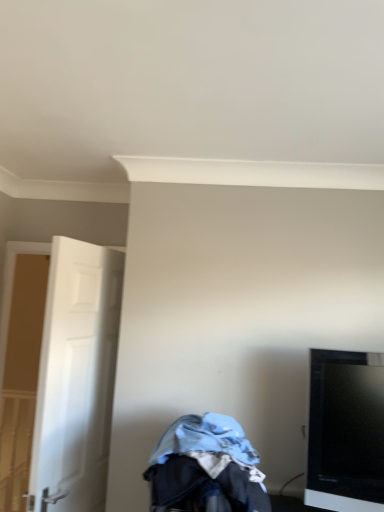
Identify the location of black glossy tv at right. (345, 431).

From the image's perspective, does denim fabric baby carriage at lower center appear lower than black glossy tv at right?

Yes, from the image's perspective, denim fabric baby carriage at lower center is beneath black glossy tv at right.

Is denim fabric baby carriage at lower center bigger than black glossy tv at right?

Yes, denim fabric baby carriage at lower center is bigger than black glossy tv at right.

Choose the correct answer: Is denim fabric baby carriage at lower center inside black glossy tv at right or outside it?

denim fabric baby carriage at lower center is outside black glossy tv at right.

Is white matte door at left bigger than black glossy tv at right?

Indeed, white matte door at left has a larger size compared to black glossy tv at right.

Between white matte door at left and black glossy tv at right, which one has larger width?

Wider between the two is black glossy tv at right.

Identify the location of door above the black glossy tv at right (from a real-world perspective). (76, 377).

Considering the sizes of white matte door at left and denim fabric baby carriage at lower center in the image, is white matte door at left bigger or smaller than denim fabric baby carriage at lower center?

white matte door at left is bigger than denim fabric baby carriage at lower center.

Is white matte door at left not near denim fabric baby carriage at lower center?

No, white matte door at left is not far away from denim fabric baby carriage at lower center.

Which object is more forward, white matte door at left or denim fabric baby carriage at lower center?

Positioned in front is denim fabric baby carriage at lower center.

Considering the positions of objects black glossy tv at right and denim fabric baby carriage at lower center in the image provided, who is more to the right, black glossy tv at right or denim fabric baby carriage at lower center?

Positioned to the right is black glossy tv at right.

Looking at their sizes, would you say black glossy tv at right is wider or thinner than denim fabric baby carriage at lower center?

Clearly, black glossy tv at right has less width compared to denim fabric baby carriage at lower center.

Is black glossy tv at right facing away from denim fabric baby carriage at lower center?

black glossy tv at right is not turned away from denim fabric baby carriage at lower center.

From the image's perspective, which is above, black glossy tv at right or denim fabric baby carriage at lower center?

From the image's view, black glossy tv at right is above.

Which of these two, denim fabric baby carriage at lower center or white matte door at left, is wider?

Wider between the two is denim fabric baby carriage at lower center.

Is denim fabric baby carriage at lower center far away from white matte door at left?

No, there isn't a large distance between denim fabric baby carriage at lower center and white matte door at left.

Considering the sizes of denim fabric baby carriage at lower center and white matte door at left in the image, is denim fabric baby carriage at lower center bigger or smaller than white matte door at left?

Clearly, denim fabric baby carriage at lower center is smaller in size than white matte door at left.

Looking at this image, measure the distance between denim fabric baby carriage at lower center and white matte door at left.

69.31 centimeters.

Between point (332, 408) and point (67, 366), which one is positioned behind?

The point (67, 366) is farther.

Is black glossy tv at right taller or shorter than white matte door at left?

Considering their sizes, black glossy tv at right has less height than white matte door at left.

Considering the sizes of objects black glossy tv at right and white matte door at left in the image provided, who is thinner, black glossy tv at right or white matte door at left?

white matte door at left.

How much distance is there between black glossy tv at right and white matte door at left?

A distance of 3.39 feet exists between black glossy tv at right and white matte door at left.

This screenshot has width=384, height=512. I want to click on baby carriage below the black glossy tv at right (from a real-world perspective), so click(x=205, y=466).

Locate an element on the screen. television on the right of white matte door at left is located at coordinates (345, 431).

Looking at this image, from the image, which object appears to be farther from black glossy tv at right, white matte door at left or denim fabric baby carriage at lower center?

white matte door at left lies further to black glossy tv at right than the other object.

From the image, which object appears to be nearer to white matte door at left, denim fabric baby carriage at lower center or black glossy tv at right?

denim fabric baby carriage at lower center is closer to white matte door at left.

From the image, which object appears to be nearer to denim fabric baby carriage at lower center, black glossy tv at right or white matte door at left?

black glossy tv at right is positioned closer to the anchor denim fabric baby carriage at lower center.

When comparing their distances from white matte door at left, does black glossy tv at right or denim fabric baby carriage at lower center seem closer?

denim fabric baby carriage at lower center lies closer to white matte door at left than the other object.

Considering their positions, is white matte door at left positioned further to denim fabric baby carriage at lower center than black glossy tv at right?

white matte door at left is positioned further to the anchor denim fabric baby carriage at lower center.

Based on their spatial positions, is denim fabric baby carriage at lower center or white matte door at left closer to black glossy tv at right?

denim fabric baby carriage at lower center is closer to black glossy tv at right.

Image resolution: width=384 pixels, height=512 pixels. Identify the location of baby carriage located between white matte door at left and black glossy tv at right in the left-right direction. (205, 466).